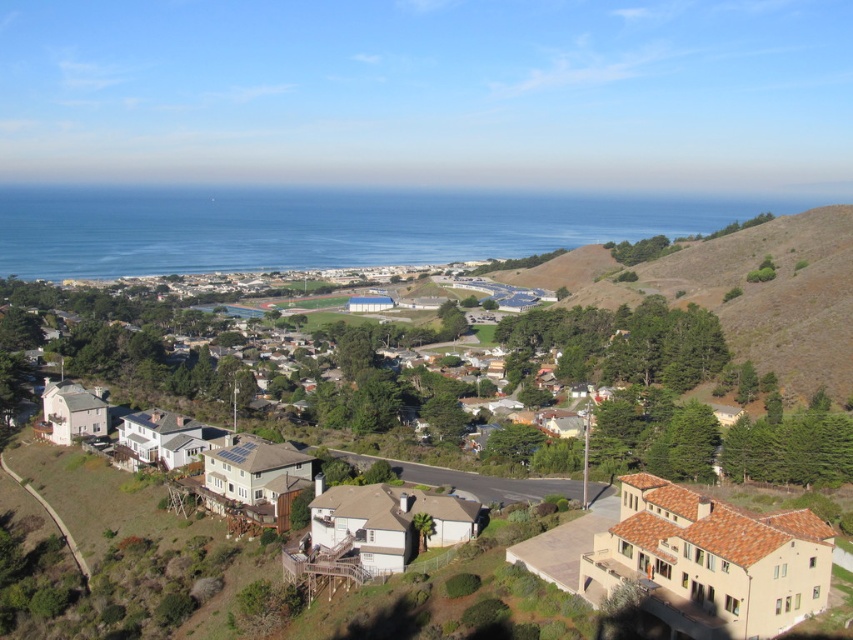
Consider the image. Who is higher up, blue water at center or brown grassy hillside at center-right?

blue water at center is higher up.

Does blue water at center appear under brown grassy hillside at center-right?

No.

Find the location of a particular element. The height and width of the screenshot is (640, 853). blue water at center is located at coordinates (323, 227).

Where is `blue water at center`? blue water at center is located at coordinates (323, 227).

Which is above, brown grassy hillside at center-right or beige stucco houses at center?

brown grassy hillside at center-right is above.

This screenshot has width=853, height=640. In order to click on brown grassy hillside at center-right in this screenshot , I will do `click(741, 291)`.

Where is `brown grassy hillside at center-right`? The image size is (853, 640). brown grassy hillside at center-right is located at coordinates [x=741, y=291].

Describe the element at coordinates (323, 227) in the screenshot. I see `blue water at center` at that location.

Is point (360, 214) closer to camera compared to point (672, 332)?

No.

Between point (662, 198) and point (366, 532), which one is positioned in front?

Point (366, 532) is more forward.

This screenshot has height=640, width=853. In order to click on blue water at center in this screenshot , I will do `click(323, 227)`.